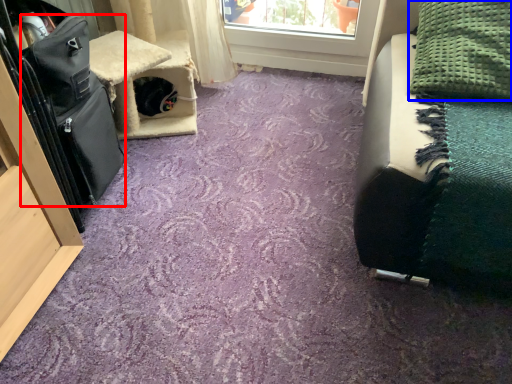
Question: Among these objects, which one is nearest to the camera, luggage (highlighted by a red box) or blanket (highlighted by a blue box)?

Choices:
 (A) luggage
 (B) blanket

Answer: (A)